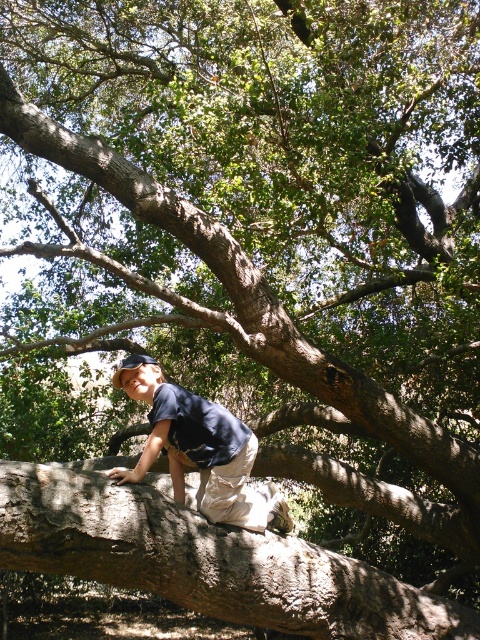
You are a photographer aiming to capture the dark blue shirt at center and the brown rough tree trunk at center in a single frame. Based on their positions, which object is located to the right side of the other?

The brown rough tree trunk at center is to the right of the dark blue shirt at center.

You are a photographer trying to capture a closeup of the brown rough tree trunk at center and the dark blue shirt at center. Which object should you zoom in on first to ensure it fits entirely within the camera frame?

The dark blue shirt at center should be zoomed in on first because the brown rough tree trunk at center is wider, so focusing on the narrower dark blue shirt at center ensures it fits before adjusting for the wider trunk.

Based on the photo, you are a photographer trying to capture a portrait of the person wearing the dark blue shirt at center. To ensure the brown rough tree trunk at center doesn not appear in the background, where should you position yourself relative to the person?

The brown rough tree trunk at center is positioned under the dark blue shirt at center, so you should position yourself to the side or behind the person to avoid the tree trunk appearing in the background.